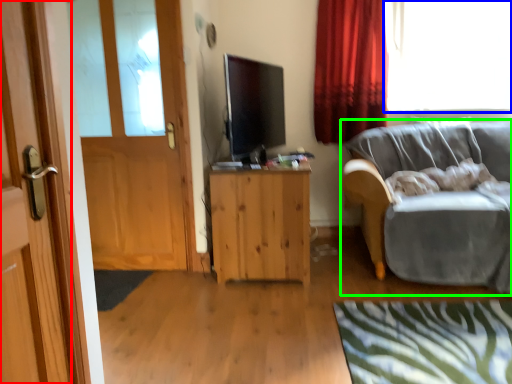
Question: Which object is the farthest from door (highlighted by a red box)? Choose among these: window (highlighted by a blue box) or studio couch (highlighted by a green box).

Choices:
 (A) window
 (B) studio couch

Answer: (A)